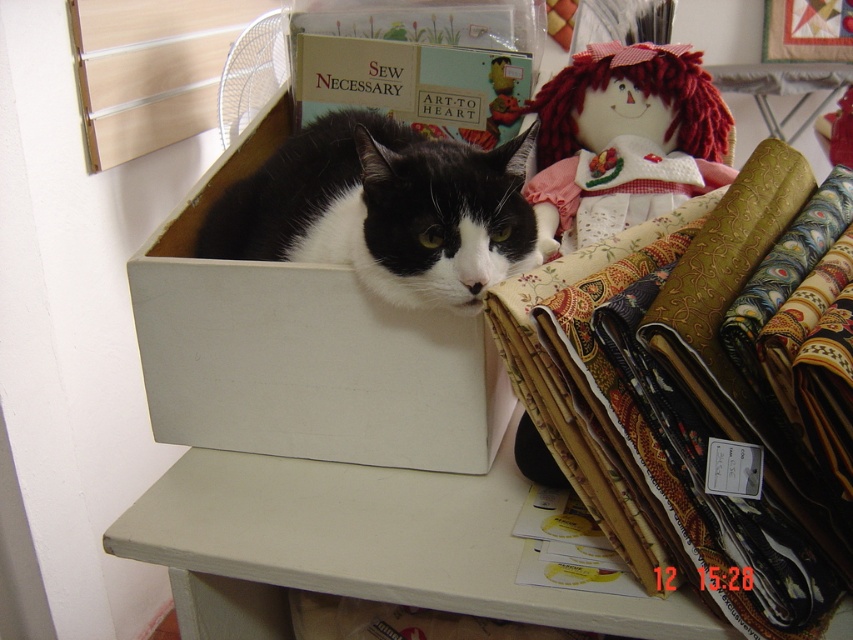
Is white matte box at center bigger than matte cardboard box at center?

Indeed, white matte box at center has a larger size compared to matte cardboard box at center.

Is white matte box at center thinner than matte cardboard box at center?

Incorrect, white matte box at center's width is not less than matte cardboard box at center's.

At what (x,y) coordinates should I click in order to perform the action: click on white matte box at center. Please return your answer as a coordinate pair (x, y). Looking at the image, I should click on (303, 352).

Is white matte table at center closer to the viewer compared to fluffy red yarn doll at upper right?

Yes, it is.

Between white matte table at center and fluffy red yarn doll at upper right, which one appears on the right side from the viewer's perspective?

From the viewer's perspective, fluffy red yarn doll at upper right appears more on the right side.

This screenshot has width=853, height=640. What do you see at coordinates (358, 547) in the screenshot? I see `white matte table at center` at bounding box center [358, 547].

Image resolution: width=853 pixels, height=640 pixels. In order to click on white matte table at center in this screenshot , I will do `click(358, 547)`.

Based on the photo, can you confirm if black and white fur cat at center is positioned below fluffy red yarn doll at upper right?

Yes, black and white fur cat at center is below fluffy red yarn doll at upper right.

The width and height of the screenshot is (853, 640). I want to click on black and white fur cat at center, so click(x=381, y=209).